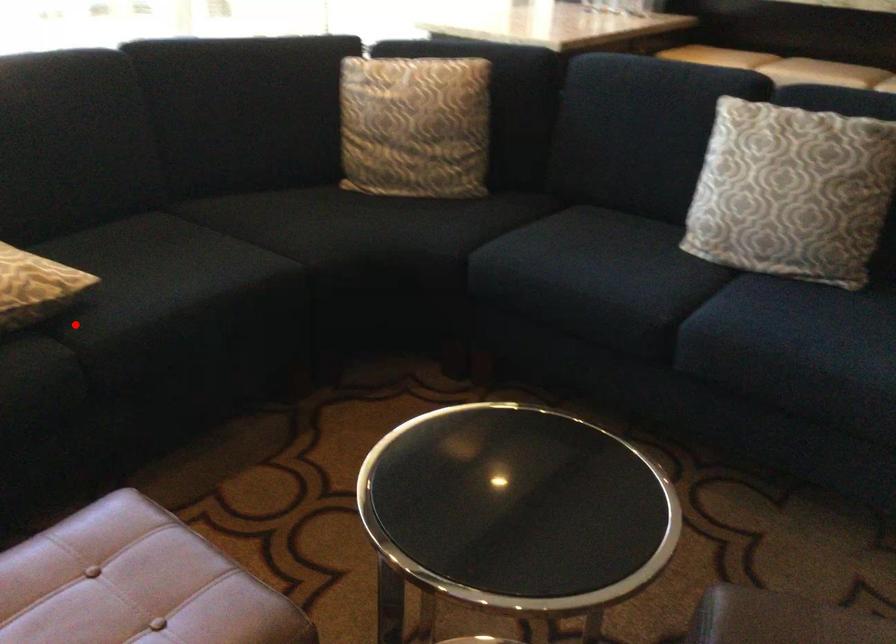
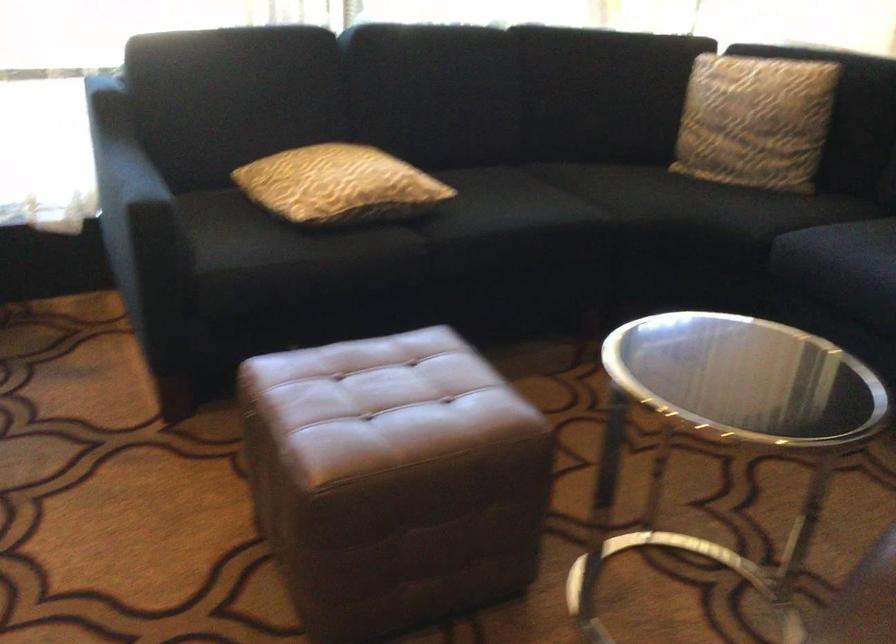
Question: I am providing you with two images of the same scene from different viewpoints. A red point is shown in image1. For the corresponding object point in image2, is it positioned nearer or farther from the camera?

Choices:
 (A) Nearer
 (B) Farther

Answer: (B)